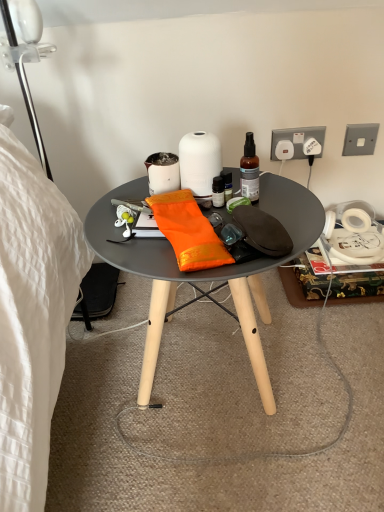
Question: Is the position of orange silk cloth at center less distant than that of white matte vase at center?

Choices:
 (A) yes
 (B) no

Answer: (A)

Question: Does orange silk cloth at center have a greater width compared to white matte vase at center?

Choices:
 (A) yes
 (B) no

Answer: (A)

Question: From the image's perspective, is orange silk cloth at center on top of white matte vase at center?

Choices:
 (A) yes
 (B) no

Answer: (B)

Question: Does orange silk cloth at center appear on the right side of white matte vase at center?

Choices:
 (A) yes
 (B) no

Answer: (B)

Question: From the image's perspective, is orange silk cloth at center below white matte vase at center?

Choices:
 (A) yes
 (B) no

Answer: (A)

Question: Is translucent glass spray bottle at upper right taller or shorter than white plastic power outlet at upper right, positioned as the second power outlet in left-to-right order?

Choices:
 (A) short
 (B) tall

Answer: (B)

Question: From a real-world perspective, is translucent glass spray bottle at upper right positioned above or below white plastic power outlet at upper right, which ranks as the 3th power outlet in right-to-left order?

Choices:
 (A) below
 (B) above

Answer: (B)

Question: In the image, is translucent glass spray bottle at upper right on the left side or the right side of white plastic power outlet at upper right, positioned as the second power outlet in left-to-right order?

Choices:
 (A) left
 (B) right

Answer: (A)

Question: Is point (249, 154) positioned closer to the camera than point (296, 139)?

Choices:
 (A) closer
 (B) farther

Answer: (A)

Question: Looking at the image, does metallic silver power outlet at upper right, marked as the 4th power outlet in a left-to-right arrangement, seem bigger or smaller compared to matte white coffee cup at center?

Choices:
 (A) big
 (B) small

Answer: (B)

Question: From the image's perspective, relative to matte white coffee cup at center, is metallic silver power outlet at upper right, marked as the 4th power outlet in a left-to-right arrangement, above or below?

Choices:
 (A) above
 (B) below

Answer: (A)

Question: Considering the positions of metallic silver power outlet at upper right, acting as the first power outlet starting from the right, and matte white coffee cup at center in the image, is metallic silver power outlet at upper right, acting as the first power outlet starting from the right, wider or thinner than matte white coffee cup at center?

Choices:
 (A) wide
 (B) thin

Answer: (B)

Question: Is metallic silver power outlet at upper right, acting as the first power outlet starting from the right, inside or outside of matte white coffee cup at center?

Choices:
 (A) outside
 (B) inside

Answer: (A)

Question: In the image, is translucent glass spray bottle at upper right positioned in front of or behind matte black table at center?

Choices:
 (A) behind
 (B) front

Answer: (A)

Question: Is translucent glass spray bottle at upper right inside or outside of matte black table at center?

Choices:
 (A) outside
 (B) inside

Answer: (A)